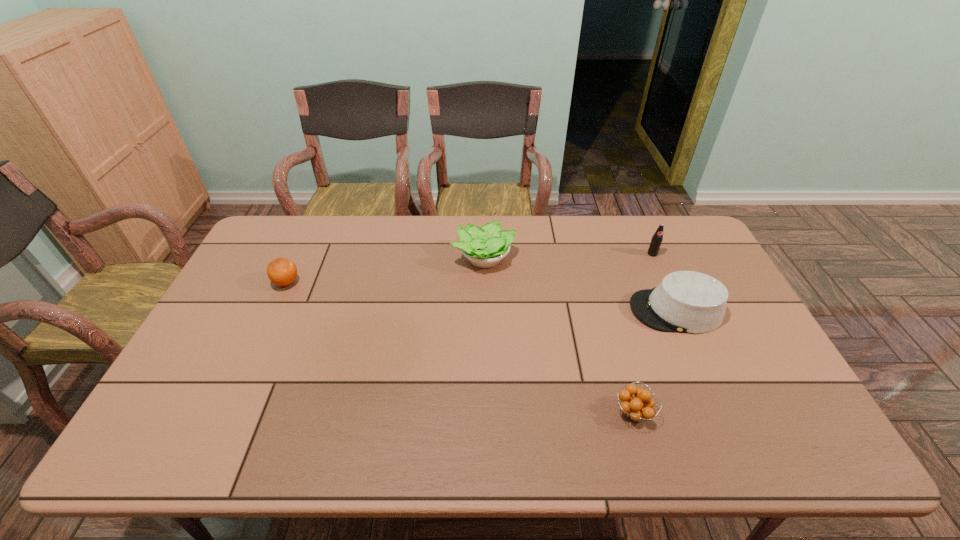
This screenshot has width=960, height=540. In order to click on vacant area between the nearest object and the hat in this screenshot , I will do `click(655, 361)`.

What are the coordinates of `free space between the leftmost object and the tallest object` in the screenshot? It's located at (469, 268).

Image resolution: width=960 pixels, height=540 pixels. What are the coordinates of `vacant area between the tallest object and the leftmost object` in the screenshot? It's located at (469, 268).

Where is `object that can be found as the third closest to the hat`? This screenshot has height=540, width=960. object that can be found as the third closest to the hat is located at coordinates (484, 247).

Identify which object is the second nearest to the nearest object. Please provide its 2D coordinates. Your answer should be formatted as a tuple, i.e. [(x, y)], where the tuple contains the x and y coordinates of a point satisfying the conditions above.

[(484, 247)]